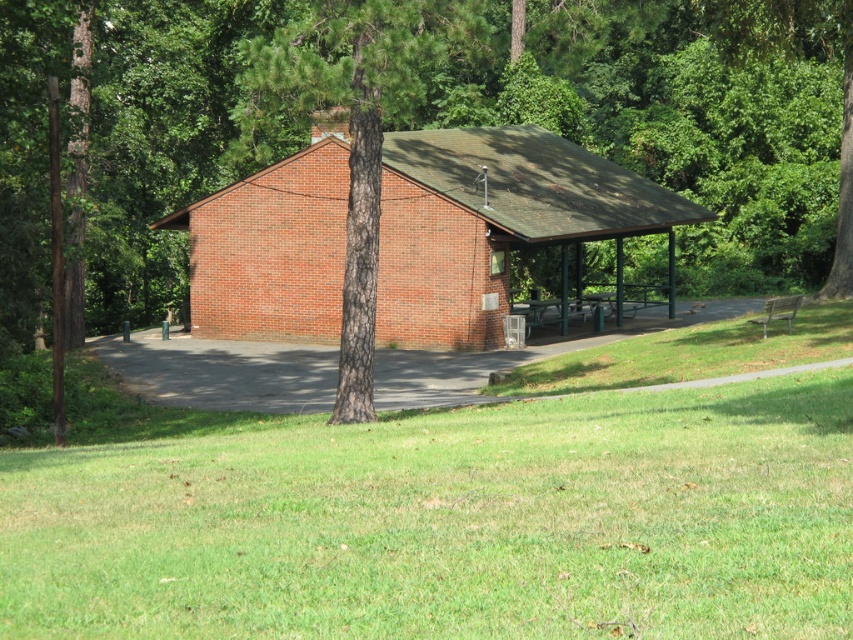
You are planning to set up a small event in the area shown in the image. You need to place a large tent that requires a flat space larger than the brick hut at center. Is there enough space available on the green metal picnic table at center to accommodate the tent?

The brick hut at center is bigger than the green metal picnic table at center. Since the tent requires a flat space larger than the brick hut, the green metal picnic table at center is not large enough to accommodate the tent.

You are planning to set up a picnic in the area shown. You want to ensure that your picnic blanket will be in direct sunlight. Given that the smooth bark tree at center and the green metal picnic table at center are both at the center, which object should you place your blanket under to avoid shade?

The smooth bark tree at center is above the green metal picnic table at center, so placing the blanket under the green metal picnic table at center would be in the shade. To avoid shade, place the blanket under the smooth bark tree at center where there is no obstruction.

You are a gardener standing at the entrance of the brick hut at center. You notice a brown rough bark tree at center nearby. Which direction should you walk to reach the tree from your current position?

The brick hut at center is positioned on the right side of the brown rough bark tree at center, so to reach the tree, you should walk to your left.